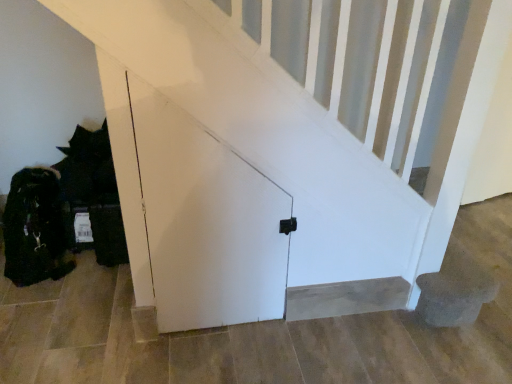
What do you see at coordinates (346, 298) in the screenshot? I see `smooth beige carpet at lower center` at bounding box center [346, 298].

Measure the distance between point (383, 307) and camera.

Point (383, 307) and camera are 1.65 meters apart.

The width and height of the screenshot is (512, 384). In order to click on smooth beige carpet at lower center in this screenshot , I will do `click(346, 298)`.

The image size is (512, 384). What do you see at coordinates (206, 222) in the screenshot?
I see `white matte door at center` at bounding box center [206, 222].

You are a GUI agent. You are given a task and a screenshot of the screen. Output one action in this format:
    pyautogui.click(x=<x>, y=<y>)
    Task: Click on the white matte door at center
    
    Given the screenshot: What is the action you would take?
    pyautogui.click(x=206, y=222)

I want to click on smooth beige carpet at lower center, so click(346, 298).

Based on the photo, can you confirm if white matte door at center is positioned to the left of smooth beige carpet at lower center?

Correct, you'll find white matte door at center to the left of smooth beige carpet at lower center.

Is the position of white matte door at center more distant than that of smooth beige carpet at lower center?

No, the depth of white matte door at center is less than that of smooth beige carpet at lower center.

Between point (184, 127) and point (321, 312), which one is positioned in front?

Point (184, 127)

From the image's perspective, is white matte door at center located above or below smooth beige carpet at lower center?

white matte door at center is above smooth beige carpet at lower center.

From a real-world perspective, is white matte door at center above or below smooth beige carpet at lower center?

In terms of real-world spatial position, white matte door at center is above smooth beige carpet at lower center.

Based on the photo, does white matte door at center have a lesser width compared to smooth beige carpet at lower center?

Incorrect, the width of white matte door at center is not less than that of smooth beige carpet at lower center.

Which of these two, white matte door at center or smooth beige carpet at lower center, stands taller?

white matte door at center is taller.

Considering the sizes of white matte door at center and smooth beige carpet at lower center in the image, is white matte door at center bigger or smaller than smooth beige carpet at lower center?

Clearly, white matte door at center is larger in size than smooth beige carpet at lower center.

Is white matte door at center situated inside smooth beige carpet at lower center or outside?

The correct answer is: outside.

Is white matte door at center next to smooth beige carpet at lower center and touching it?

No, white matte door at center is not next to smooth beige carpet at lower center.

Is white matte door at center turned away from smooth beige carpet at lower center?

No.

Identify the location of door on the left side of smooth beige carpet at lower center. (x=206, y=222).

Does smooth beige carpet at lower center appear on the right side of white matte door at center?

Yes, smooth beige carpet at lower center is to the right of white matte door at center.

Looking at this image, is the depth of smooth beige carpet at lower center less than that of white matte door at center?

No, the depth of smooth beige carpet at lower center is greater than that of white matte door at center.

Which point is more forward, [374,296] or [200,165]?

Point [200,165]

From the image's perspective, who appears lower, smooth beige carpet at lower center or white matte door at center?

smooth beige carpet at lower center is shown below in the image.

From a real-world perspective, is smooth beige carpet at lower center located higher than white matte door at center?

No, from a real-world perspective, smooth beige carpet at lower center is not over white matte door at center

Between smooth beige carpet at lower center and white matte door at center, which one has smaller width?

With smaller width is smooth beige carpet at lower center.

Which of these two, smooth beige carpet at lower center or white matte door at center, stands shorter?

smooth beige carpet at lower center.

Is smooth beige carpet at lower center smaller than white matte door at center?

Indeed, smooth beige carpet at lower center has a smaller size compared to white matte door at center.

Would you say smooth beige carpet at lower center is outside white matte door at center?

Absolutely, smooth beige carpet at lower center is external to white matte door at center.

Are smooth beige carpet at lower center and white matte door at center located far from each other?

smooth beige carpet at lower center is near white matte door at center, not far away.

Could you tell me if smooth beige carpet at lower center is facing white matte door at center?

No, smooth beige carpet at lower center is not facing towards white matte door at center.

Can you tell me how much smooth beige carpet at lower center and white matte door at center differ in facing direction?

The angular difference between smooth beige carpet at lower center and white matte door at center is 2.39 degrees.

In order to click on stairwell behind the white matte door at center in this screenshot , I will do `click(346, 298)`.

Locate an element on the screen. Image resolution: width=512 pixels, height=384 pixels. door in front of the smooth beige carpet at lower center is located at coordinates (206, 222).

This screenshot has width=512, height=384. In order to click on door located above the smooth beige carpet at lower center (from the image's perspective) in this screenshot , I will do `click(206, 222)`.